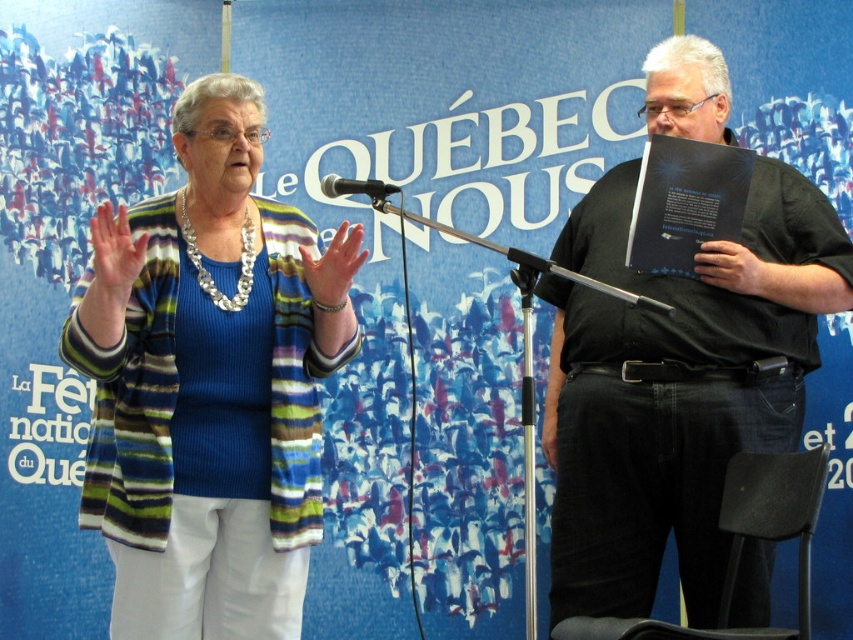
Question: Is black matte shirt at center thinner than smooth skin hand at center?

Choices:
 (A) yes
 (B) no

Answer: (B)

Question: Which object appears farthest from the camera in this image?

Choices:
 (A) black matte shirt at center
 (B) striped knit cardigan at center

Answer: (A)

Question: In this image, where is black matte shirt at center located relative to smooth skin hand at center?

Choices:
 (A) above
 (B) below

Answer: (B)

Question: Which point is closer to the camera?

Choices:
 (A) black matte book at center
 (B) striped knit cardigan at center
 (C) black plastic microphone at center
 (D) smooth skin hand at center

Answer: (B)

Question: Is black matte shirt at center further to the viewer compared to black matte book at center?

Choices:
 (A) yes
 (B) no

Answer: (B)

Question: Which of the following is the closest to the observer?

Choices:
 (A) (323, 192)
 (B) (744, 244)
 (C) (350, 307)
 (D) (766, 275)

Answer: (C)